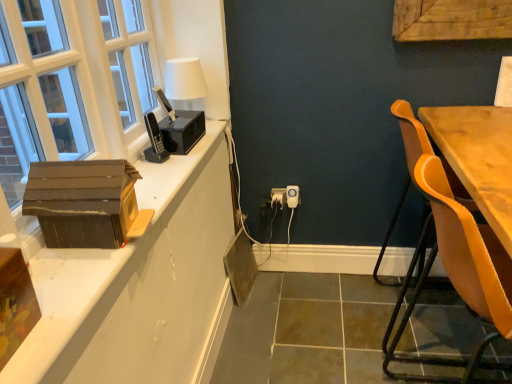
The image size is (512, 384). Identify the location of free point above brown wood cabinetry at left (from a real-world perspective). (146, 208).